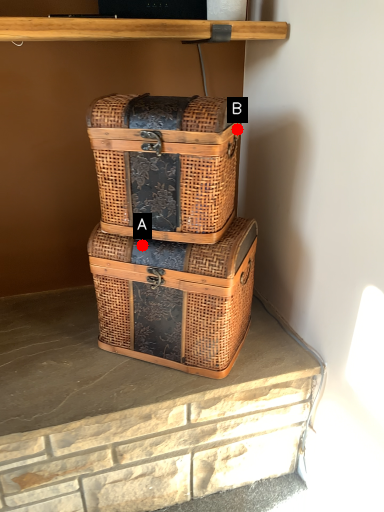
Question: Two points are circled on the image, labeled by A and B beside each circle. Which point is closer to the camera?

Choices:
 (A) A is closer
 (B) B is closer

Answer: (B)